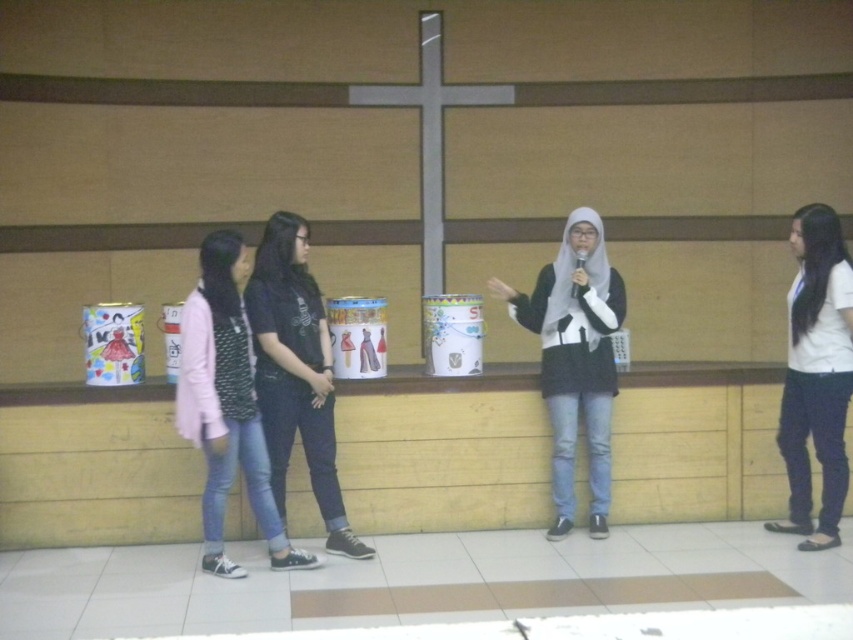
Question: Which point appears farthest from the camera in this image?

Choices:
 (A) (801, 497)
 (B) (292, 404)

Answer: (A)

Question: Can you confirm if matte black hijab at center is positioned to the right of dark blue jeans at center?

Choices:
 (A) no
 (B) yes

Answer: (B)

Question: Among these points, which one is farthest from the camera?

Choices:
 (A) (268, 547)
 (B) (596, 480)
 (C) (312, 314)
 (D) (798, 404)

Answer: (B)

Question: Which point is farther from the camera taking this photo?

Choices:
 (A) (281, 428)
 (B) (193, 385)
 (C) (834, 360)

Answer: (A)

Question: Can you confirm if denim jacket at center is thinner than matte black hijab at center?

Choices:
 (A) no
 (B) yes

Answer: (B)

Question: Can you confirm if denim jacket at center is positioned to the left of dark blue jeans at center?

Choices:
 (A) yes
 (B) no

Answer: (A)